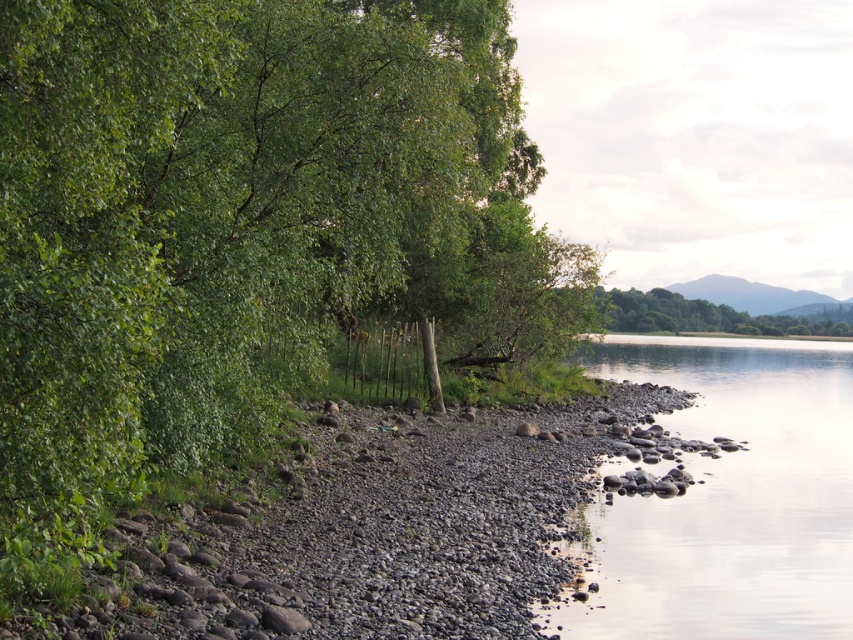
Based on the scene, what can be found at the coordinates point (235, 228)?

At point (235, 228) lies green leafy tree at left.

You are standing at the lakeside and want to take a photo of both the green leafy tree at left and the smooth stone river at lower right. Which object should you adjust your camera angle to include first if you want to capture both in the frame?

The green leafy tree at left is taller than the smooth stone river at lower right, so you should adjust your camera angle to include the taller green leafy tree at left first to ensure both are in the frame.

Based on the scene description, where is the smooth gravel river bank at center located in the image?

The smooth gravel river bank at center is located at point (366, 532) in the image.